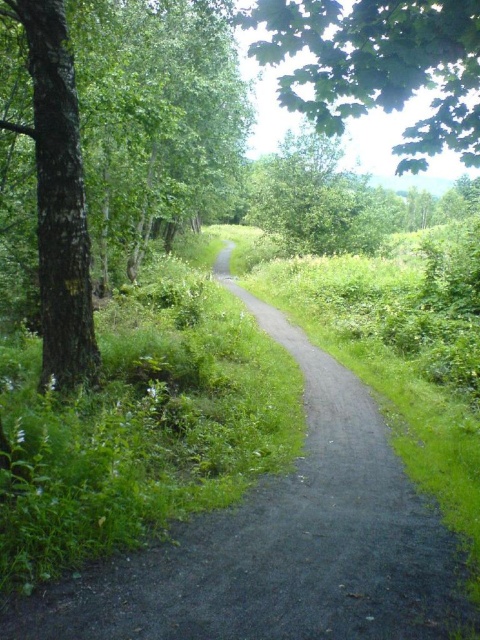
Which is more to the left, green leafy tree at upper center or smooth bark tree at left?

From the viewer's perspective, smooth bark tree at left appears more on the left side.

Is green leafy tree at upper center positioned behind smooth bark tree at left?

No, green leafy tree at upper center is closer to the viewer.

Does point (396, 19) lie behind point (49, 90)?

No, (396, 19) is in front of (49, 90).

Identify the location of green leafy tree at upper center. (377, 67).

Which is behind, point (31, 600) or point (459, 38)?

Point (459, 38)

Does dirt path at center appear over green leafy tree at upper center?

Incorrect, dirt path at center is not positioned above green leafy tree at upper center.

Who is more forward, (192, 621) or (395, 42)?

Point (192, 621) is in front.

You are a GUI agent. You are given a task and a screenshot of the screen. Output one action in this format:
    pyautogui.click(x=<x>, y=<y>)
    Task: Click on the dirt path at center
    Image resolution: width=480 pixels, height=640 pixels.
    Given the screenshot: What is the action you would take?
    pyautogui.click(x=283, y=541)

Is dirt path at center taller than smooth bark tree at left?

In fact, dirt path at center may be shorter than smooth bark tree at left.

Is dirt path at center shorter than smooth bark tree at left?

Indeed, dirt path at center has a lesser height compared to smooth bark tree at left.

What do you see at coordinates (283, 541) in the screenshot?
I see `dirt path at center` at bounding box center [283, 541].

Where is `dirt path at center`? The image size is (480, 640). dirt path at center is located at coordinates (283, 541).